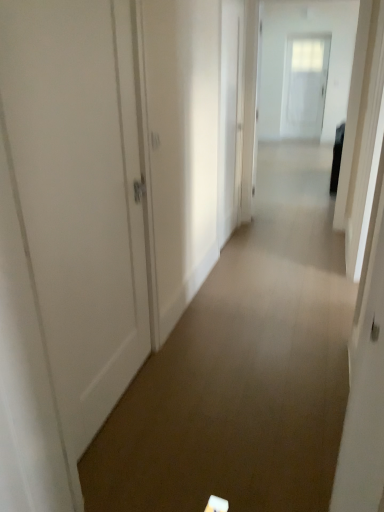
You are a GUI agent. You are given a task and a screenshot of the screen. Output one action in this format:
    pyautogui.click(x=<x>, y=<y>)
    Task: Click on the white glossy door at upper center
    This screenshot has width=384, height=512.
    Given the screenshot: What is the action you would take?
    pyautogui.click(x=295, y=74)

Image resolution: width=384 pixels, height=512 pixels. In order to click on white glossy door at center, which is the 2th door in bottom-to-top order in this screenshot , I will do `click(230, 117)`.

This screenshot has width=384, height=512. Describe the element at coordinates (304, 85) in the screenshot. I see `white glossy door at upper center, positioned as the third door in bottom-to-top order` at that location.

Image resolution: width=384 pixels, height=512 pixels. Find the location of `white glossy door at upper center, the 1th door from the top`. white glossy door at upper center, the 1th door from the top is located at coordinates (304, 85).

At what (x,y) coordinates should I click in order to perform the action: click on white matte door at left, which is the third door from top to bottom. Please return your answer as a coordinate pair (x, y). The image size is (384, 512). Looking at the image, I should click on (80, 194).

Who is shorter, white matte door at left, arranged as the 3th door when viewed from the back, or white glossy door at upper center, the first door viewed from the back?

white matte door at left, arranged as the 3th door when viewed from the back, is shorter.

Considering the relative sizes of white matte door at left, which ranks as the 1th door in left-to-right order, and white glossy door at upper center, arranged as the third door when viewed from the front, in the image provided, is white matte door at left, which ranks as the 1th door in left-to-right order, smaller than white glossy door at upper center, arranged as the third door when viewed from the front,?

Correct, white matte door at left, which ranks as the 1th door in left-to-right order, occupies less space than white glossy door at upper center, arranged as the third door when viewed from the front.

From a real-world perspective, is white matte door at left, which ranks as the first door in bottom-to-top order, positioned over white glossy door at upper center, arranged as the third door when viewed from the front, based on gravity?

No, from a real-world perspective, white matte door at left, which ranks as the first door in bottom-to-top order, is not above white glossy door at upper center, arranged as the third door when viewed from the front.

Which is behind, white matte door at left, which ranks as the 1th door in left-to-right order, or white glossy door at upper center, the first door viewed from the back?

white glossy door at upper center, the first door viewed from the back.

Does white glossy door at upper center, positioned as the third door in bottom-to-top order, have a greater width compared to white glossy door at upper center?

Indeed, white glossy door at upper center, positioned as the third door in bottom-to-top order, has a greater width compared to white glossy door at upper center.

From the image's perspective, is white glossy door at upper center, the 1th door from the top, located above or below white glossy door at upper center?

Clearly, from the image's perspective, white glossy door at upper center, the 1th door from the top, is above white glossy door at upper center.

Is white glossy door at upper center, marked as the 1th door in a right-to-left arrangement, shorter than white glossy door at upper center?

In fact, white glossy door at upper center, marked as the 1th door in a right-to-left arrangement, may be taller than white glossy door at upper center.

Could you tell me if white glossy door at upper center, the first door viewed from the back, is facing white glossy door at upper center?

Yes, white glossy door at upper center, the first door viewed from the back, is turned towards white glossy door at upper center.

From a real-world perspective, is white glossy door at upper center, marked as the 1th door in a right-to-left arrangement, over white matte door at left, which ranks as the first door in bottom-to-top order?

Yes, from a real-world perspective, white glossy door at upper center, marked as the 1th door in a right-to-left arrangement, is on top of white matte door at left, which ranks as the first door in bottom-to-top order.

From the image's perspective, starting from the white glossy door at upper center, placed as the 3th door when sorted from left to right, which door is the 2nd one below? Please provide its 2D coordinates.

[(80, 194)]

Is there a large distance between white glossy door at upper center, the 1th door from the top, and white matte door at left, arranged as the third door when viewed from the right?

That's right, there is a large distance between white glossy door at upper center, the 1th door from the top, and white matte door at left, arranged as the third door when viewed from the right.

How different are the orientations of white glossy door at upper center, placed as the 3th door when sorted from left to right, and white matte door at left, which ranks as the first door in bottom-to-top order, in degrees?

They differ by 89.3 degrees in their facing directions.

Considering the sizes of objects white glossy door at center, which ranks as the 2th door in left-to-right order, and white glossy door at upper center in the image provided, who is wider, white glossy door at center, which ranks as the 2th door in left-to-right order, or white glossy door at upper center?

Wider between the two is white glossy door at upper center.

Is white glossy door at center, the 2th door viewed from the front, not near white glossy door at upper center?

Yes.

From the image's perspective, is white glossy door at center, which is the 2th door in bottom-to-top order, below white glossy door at upper center?

Yes, from the image's perspective, white glossy door at center, which is the 2th door in bottom-to-top order, is beneath white glossy door at upper center.

Considering the sizes of objects white glossy door at center, placed as the second door when sorted from back to front, and white matte door at left, which ranks as the 1th door in left-to-right order, in the image provided, who is taller, white glossy door at center, placed as the second door when sorted from back to front, or white matte door at left, which ranks as the 1th door in left-to-right order,?

Standing taller between the two is white glossy door at center, placed as the second door when sorted from back to front.

Is white glossy door at center, which ranks as the 2th door in left-to-right order, to the left or to the right of white matte door at left, which appears as the first door when viewed from the front, in the image?

In the image, white glossy door at center, which ranks as the 2th door in left-to-right order, appears on the right side of white matte door at left, which appears as the first door when viewed from the front.

Is white glossy door at center, the 2th door viewed from the front, situated inside white matte door at left, which appears as the first door when viewed from the front, or outside?

white glossy door at center, the 2th door viewed from the front, is not enclosed by white matte door at left, which appears as the first door when viewed from the front.

Can you confirm if white glossy door at center, marked as the second door in a top-to-bottom arrangement, is bigger than white matte door at left, which appears as the first door when viewed from the front?

Yes, white glossy door at center, marked as the second door in a top-to-bottom arrangement, is bigger than white matte door at left, which appears as the first door when viewed from the front.

Considering the points (314, 123) and (224, 145), which point is behind, point (314, 123) or point (224, 145)?

The point (314, 123) is behind.

Is white glossy door at upper center shorter than white glossy door at center, the 2th door viewed from the front?

In fact, white glossy door at upper center may be taller than white glossy door at center, the 2th door viewed from the front.

Is white glossy door at upper center to the right of white glossy door at center, marked as the second door in a top-to-bottom arrangement, from the viewer's perspective?

Correct, you'll find white glossy door at upper center to the right of white glossy door at center, marked as the second door in a top-to-bottom arrangement.

From a real-world perspective, is white glossy door at upper center physically located above or below white glossy door at center, placed as the second door when sorted from back to front?

white glossy door at upper center is below white glossy door at center, placed as the second door when sorted from back to front.

Between white glossy door at upper center, the first door viewed from the back, and white glossy door at center, marked as the second door in a top-to-bottom arrangement, which one has smaller width?

white glossy door at center, marked as the second door in a top-to-bottom arrangement.

From the image's perspective, would you say white glossy door at upper center, positioned as the third door in bottom-to-top order, is shown under white glossy door at center, which ranks as the 2th door in left-to-right order?

Incorrect, from the image's perspective, white glossy door at upper center, positioned as the third door in bottom-to-top order, is higher than white glossy door at center, which ranks as the 2th door in left-to-right order.

Is there a large distance between white glossy door at upper center, placed as the 3th door when sorted from left to right, and white glossy door at center, marked as the second door in a top-to-bottom arrangement?

Yes, white glossy door at upper center, placed as the 3th door when sorted from left to right, and white glossy door at center, marked as the second door in a top-to-bottom arrangement, are located far from each other.

Does white glossy door at upper center, arranged as the third door when viewed from the front, come behind white glossy door at center, marked as the second door in a top-to-bottom arrangement?

Yes, the depth of white glossy door at upper center, arranged as the third door when viewed from the front, is greater than that of white glossy door at center, marked as the second door in a top-to-bottom arrangement.

The width and height of the screenshot is (384, 512). I want to click on the 2nd door in front of the white glossy door at upper center, arranged as the third door when viewed from the front, starting your count from the anchor, so click(80, 194).

The image size is (384, 512). In the image, there is a white glossy door at upper center. What are the coordinates of `door above it (from the image's perspective)` in the screenshot? It's located at (304, 85).

Which object lies nearer to the anchor point white glossy door at center, acting as the second door starting from the right, white glossy door at upper center, positioned as the third door in bottom-to-top order, or white matte door at left, arranged as the third door when viewed from the right?

Among the two, white matte door at left, arranged as the third door when viewed from the right, is located nearer to white glossy door at center, acting as the second door starting from the right.

Which object lies nearer to the anchor point white matte door at left, which ranks as the first door in bottom-to-top order, white glossy door at upper center or white glossy door at center, the 2th door viewed from the front?

white glossy door at center, the 2th door viewed from the front.

Considering their positions, is white glossy door at upper center, placed as the 3th door when sorted from left to right, positioned closer to white matte door at left, which appears as the first door when viewed from the front, than white glossy door at center, the 2th door viewed from the front?

white glossy door at center, the 2th door viewed from the front, is positioned closer to the anchor white matte door at left, which appears as the first door when viewed from the front.

Which object lies nearer to the anchor point white glossy door at upper center, white glossy door at upper center, the 1th door from the top, or white glossy door at center, which ranks as the 2th door in left-to-right order?

Based on the image, white glossy door at upper center, the 1th door from the top, appears to be nearer to white glossy door at upper center.

Which object lies nearer to the anchor point white glossy door at center, which is the 2th door in bottom-to-top order, white matte door at left, which ranks as the first door in bottom-to-top order, or white glossy door at upper center, positioned as the third door in bottom-to-top order?

white matte door at left, which ranks as the first door in bottom-to-top order, lies closer to white glossy door at center, which is the 2th door in bottom-to-top order, than the other object.

When comparing their distances from white glossy door at center, acting as the second door starting from the right, does white glossy door at upper center, positioned as the third door in bottom-to-top order, or white glossy door at upper center seem closer?

The object closer to white glossy door at center, acting as the second door starting from the right, is white glossy door at upper center.

Considering their positions, is white glossy door at upper center positioned further to white matte door at left, arranged as the third door when viewed from the right, than white glossy door at upper center, positioned as the third door in bottom-to-top order?

white glossy door at upper center, positioned as the third door in bottom-to-top order, is positioned further to the anchor white matte door at left, arranged as the third door when viewed from the right.

Based on their spatial positions, is white matte door at left, which ranks as the first door in bottom-to-top order, or white glossy door at center, the 2th door viewed from the front, closer to white glossy door at upper center, placed as the 3th door when sorted from left to right?

white glossy door at center, the 2th door viewed from the front, is closer to white glossy door at upper center, placed as the 3th door when sorted from left to right.

Locate an element on the screen. The height and width of the screenshot is (512, 384). door located between white matte door at left, which ranks as the first door in bottom-to-top order, and white glossy door at upper center, marked as the 1th door in a right-to-left arrangement, in the depth direction is located at coordinates (230, 117).

What are the coordinates of `passage between white matte door at left, which ranks as the first door in bottom-to-top order, and white glossy door at upper center, placed as the 3th door when sorted from left to right, along the z-axis` in the screenshot? It's located at (295, 74).

This screenshot has width=384, height=512. Find the location of `door positioned between white matte door at left, which is the third door from top to bottom, and white glossy door at upper center from near to far`. door positioned between white matte door at left, which is the third door from top to bottom, and white glossy door at upper center from near to far is located at coordinates (230, 117).

Locate an element on the screen. This screenshot has height=512, width=384. passage between white glossy door at center, which is the 2th door in bottom-to-top order, and white glossy door at upper center, arranged as the third door when viewed from the front, along the z-axis is located at coordinates tap(295, 74).